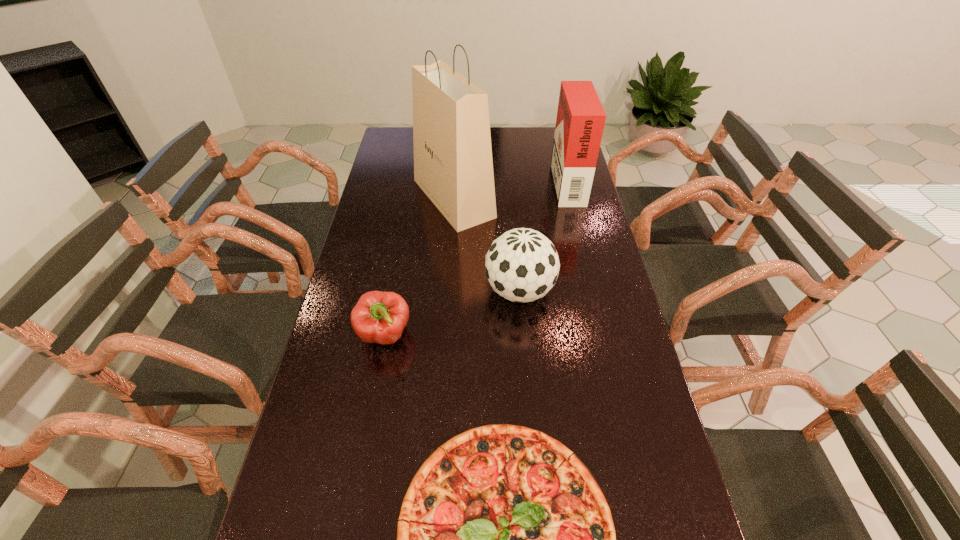
Where is `free space between the second shortest object and the tallest object`? free space between the second shortest object and the tallest object is located at coordinates (420, 266).

Where is `free spot between the soccer ball and the tallest object`? free spot between the soccer ball and the tallest object is located at coordinates (487, 245).

Locate an element on the screen. the second closest object to the third shortest object is located at coordinates (379, 317).

At what (x,y) coordinates should I click in order to perform the action: click on object that is the fourth nearest to the cigarette case. Please return your answer as a coordinate pair (x, y). The image size is (960, 540). Looking at the image, I should click on (505, 539).

This screenshot has width=960, height=540. I want to click on vacant space that satisfies the following two spatial constraints: 1. on the front-facing side of the second tallest object; 2. on the front side of the fourth tallest object, so click(x=603, y=335).

Where is `free space in the image that satisfies the following two spatial constraints: 1. on the back side of the soccer ball; 2. on the left side of the fourth tallest object`? The width and height of the screenshot is (960, 540). free space in the image that satisfies the following two spatial constraints: 1. on the back side of the soccer ball; 2. on the left side of the fourth tallest object is located at coordinates (394, 291).